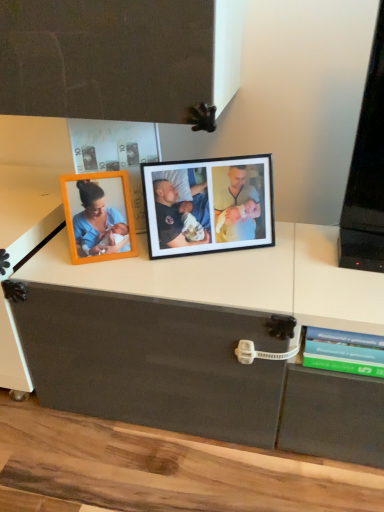
Question: Relative to black matte photo frame at center, is green matte book at lower right in front or behind?

Choices:
 (A) front
 (B) behind

Answer: (A)

Question: From a real-world perspective, relative to black matte photo frame at center, is green matte book at lower right vertically above or below?

Choices:
 (A) below
 (B) above

Answer: (A)

Question: Considering the positions of green matte book at lower right and black matte photo frame at center in the image, is green matte book at lower right wider or thinner than black matte photo frame at center?

Choices:
 (A) thin
 (B) wide

Answer: (B)

Question: In the image, is black matte photo frame at center on the left side or the right side of green matte book at lower right?

Choices:
 (A) right
 (B) left

Answer: (B)

Question: Considering the positions of point (208, 245) and point (370, 365), is point (208, 245) closer or farther from the camera than point (370, 365)?

Choices:
 (A) farther
 (B) closer

Answer: (A)

Question: Considering the positions of black matte photo frame at center and green matte book at lower right in the image, is black matte photo frame at center bigger or smaller than green matte book at lower right?

Choices:
 (A) small
 (B) big

Answer: (B)

Question: In terms of height, does black matte photo frame at center look taller or shorter compared to green matte book at lower right?

Choices:
 (A) short
 (B) tall

Answer: (B)